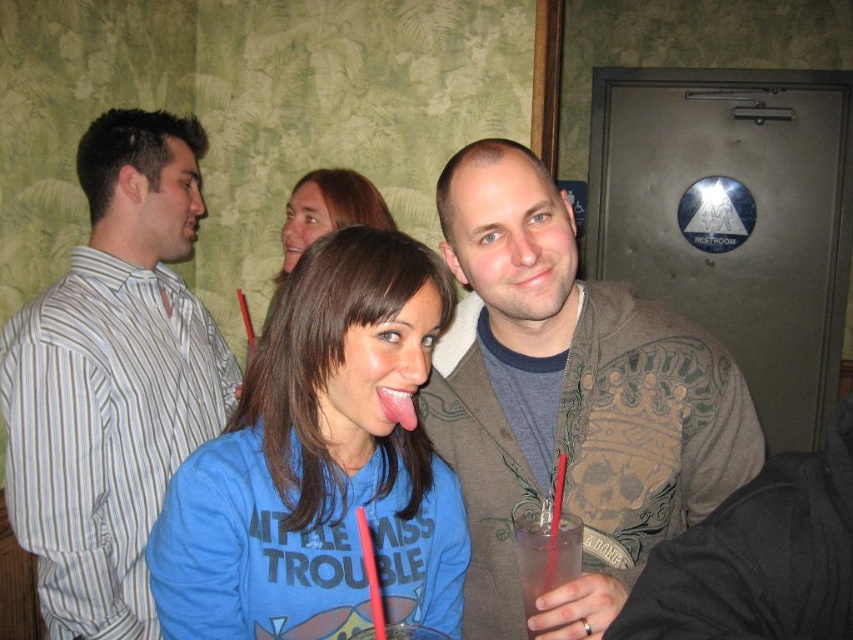
Question: Can you confirm if blue fleece sweatshirt at center is positioned above striped cotton shirt at left?

Choices:
 (A) yes
 (B) no

Answer: (B)

Question: Which of these objects is positioned closest to the clear plastic cup at center?

Choices:
 (A) blue cotton shirt at center
 (B) pink glossy tongue at center
 (C) brown textured jacket at center
 (D) blue fleece sweatshirt at center

Answer: (C)

Question: Which of the following is the closest to the observer?

Choices:
 (A) (320, 177)
 (B) (432, 499)
 (C) (529, 509)
 (D) (412, 419)

Answer: (D)

Question: Is brown textured jacket at center bigger than clear plastic cup at center?

Choices:
 (A) yes
 (B) no

Answer: (A)

Question: Which point appears farthest from the camera in this image?

Choices:
 (A) (415, 416)
 (B) (80, 186)

Answer: (B)

Question: Can you confirm if brown textured jacket at center is thinner than clear plastic cup at center?

Choices:
 (A) no
 (B) yes

Answer: (A)